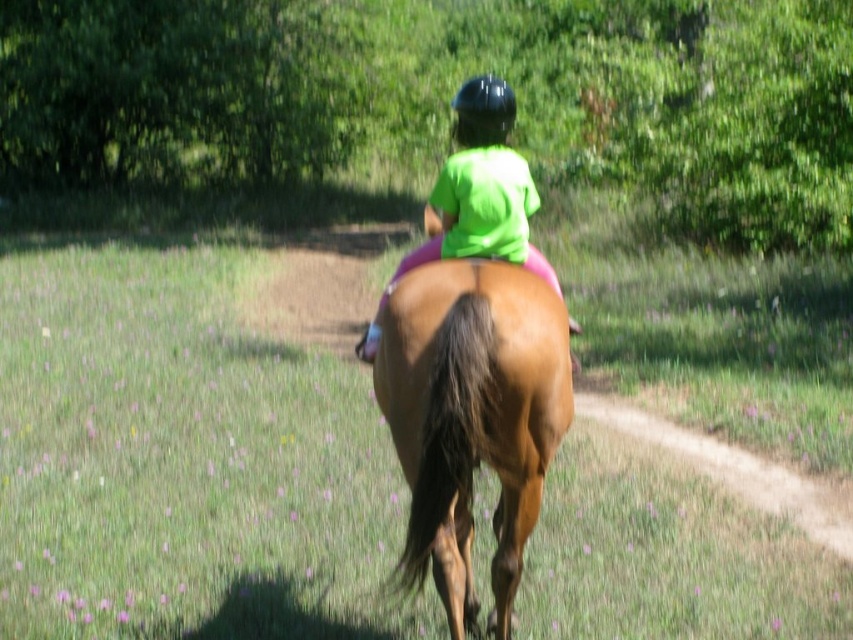
Is neon green t-shirt at center above black matte helmet at upper center?

No.

Does neon green t-shirt at center appear on the left side of black matte helmet at upper center?

Yes, neon green t-shirt at center is to the left of black matte helmet at upper center.

Which is in front, point (527, 246) or point (491, 122)?

Point (491, 122)

Identify the location of neon green t-shirt at center. The height and width of the screenshot is (640, 853). (480, 188).

The height and width of the screenshot is (640, 853). What do you see at coordinates (186, 456) in the screenshot?
I see `green grassy field at center` at bounding box center [186, 456].

Does green grassy field at center appear on the left side of black matte helmet at upper center?

Yes, green grassy field at center is to the left of black matte helmet at upper center.

You are a GUI agent. You are given a task and a screenshot of the screen. Output one action in this format:
    pyautogui.click(x=<x>, y=<y>)
    Task: Click on the green grassy field at center
    The width and height of the screenshot is (853, 640).
    Given the screenshot: What is the action you would take?
    pyautogui.click(x=186, y=456)

Does green grassy field at center appear on the right side of neon green t-shirt at center?

No, green grassy field at center is not to the right of neon green t-shirt at center.

Between green grassy field at center and neon green t-shirt at center, which one appears on the left side from the viewer's perspective?

Positioned to the left is green grassy field at center.

Who is more forward, (670, 516) or (442, 212)?

Point (442, 212) is in front.

I want to click on green grassy field at center, so click(x=186, y=456).